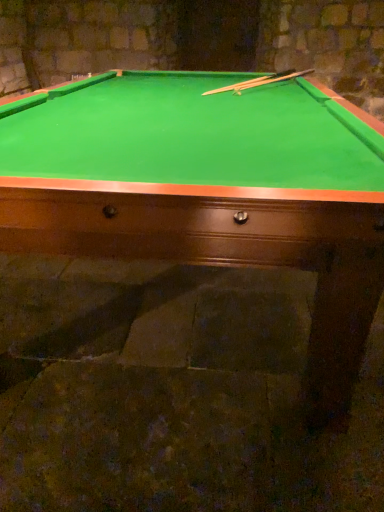
Question: Is smooth wood cue at upper center bigger or smaller than green felt billiard table at center?

Choices:
 (A) small
 (B) big

Answer: (A)

Question: Is point (279, 73) positioned closer to the camera than point (29, 181)?

Choices:
 (A) farther
 (B) closer

Answer: (A)

Question: Visually, is smooth wood cue at upper center positioned to the left or to the right of green felt billiard table at center?

Choices:
 (A) right
 (B) left

Answer: (A)

Question: Considering the positions of point (261, 217) and point (264, 77), is point (261, 217) closer or farther from the camera than point (264, 77)?

Choices:
 (A) farther
 (B) closer

Answer: (B)

Question: Considering the positions of green felt billiard table at center and smooth wood cue at upper center in the image, is green felt billiard table at center taller or shorter than smooth wood cue at upper center?

Choices:
 (A) tall
 (B) short

Answer: (A)

Question: Looking at their shapes, would you say green felt billiard table at center is wider or thinner than smooth wood cue at upper center?

Choices:
 (A) wide
 (B) thin

Answer: (A)

Question: From a real-world perspective, is green felt billiard table at center positioned above or below smooth wood cue at upper center?

Choices:
 (A) above
 (B) below

Answer: (B)